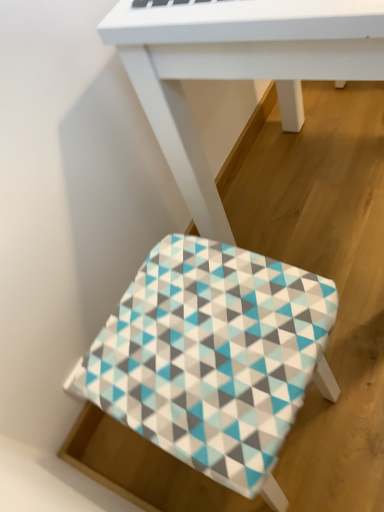
Question: Would you say patterned fabric stool at lower center is to the left or to the right of white matte table at center in the picture?

Choices:
 (A) right
 (B) left

Answer: (B)

Question: Is patterned fabric stool at lower center spatially inside white matte table at center, or outside of it?

Choices:
 (A) outside
 (B) inside

Answer: (A)

Question: In terms of width, does patterned fabric stool at lower center look wider or thinner when compared to white matte table at center?

Choices:
 (A) wide
 (B) thin

Answer: (B)

Question: Considering their positions, is white matte table at center located in front of or behind patterned fabric stool at lower center?

Choices:
 (A) behind
 (B) front

Answer: (B)

Question: In terms of width, does white matte table at center look wider or thinner when compared to patterned fabric stool at lower center?

Choices:
 (A) thin
 (B) wide

Answer: (B)

Question: In terms of size, does white matte table at center appear bigger or smaller than patterned fabric stool at lower center?

Choices:
 (A) small
 (B) big

Answer: (B)

Question: Is point (210, 215) positioned closer to the camera than point (283, 279)?

Choices:
 (A) farther
 (B) closer

Answer: (A)